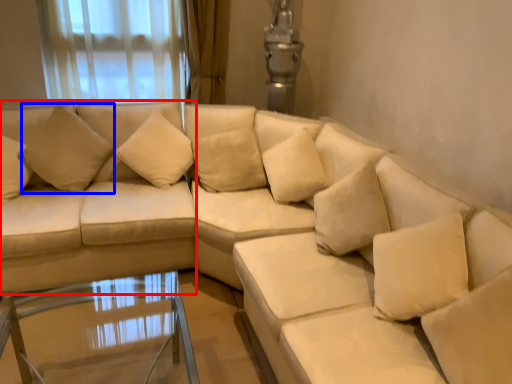
Question: Among these objects, which one is farthest to the camera, couch (highlighted by a red box) or pillow (highlighted by a blue box)?

Choices:
 (A) couch
 (B) pillow

Answer: (B)